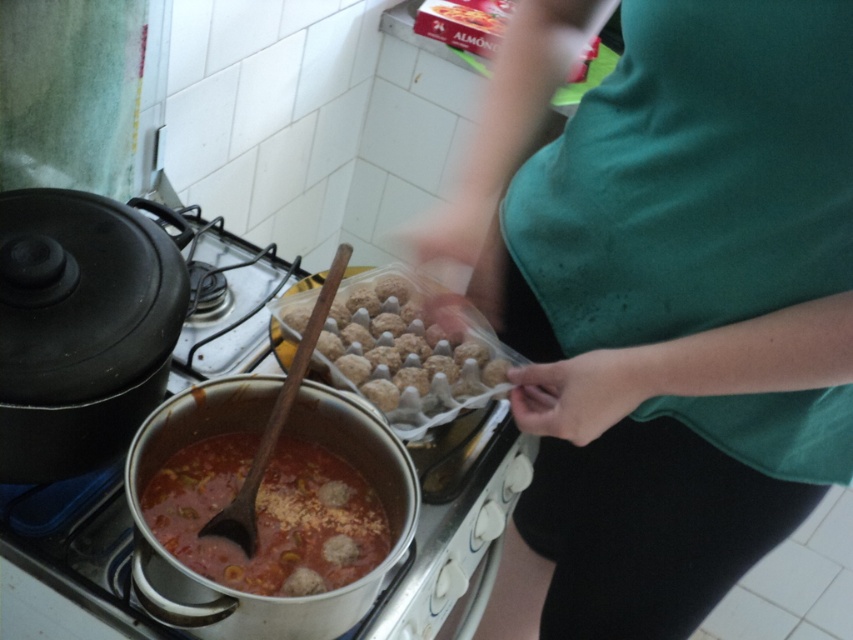
You are standing in the kitchen and want to adjust the heat on the stainless steel stove at center. However, there are brown matte meatballs at center in your way. Which object is closer to you, and can you reach the stove controls without moving the meatballs?

The stainless steel stove at center is closer to the viewer than the brown matte meatballs at center. Since the stove is closer, you can reach the controls without needing to move the meatballs.

You are a chef holding a 10 cm wide ladle and want to check the soup in the stainless steel stove at center. Can you safely reach the pot without moving closer than 70 centimeters from the stove?

The stainless steel stove at center and camera are 72.46 centimeters apart, so yes, the chef can safely reach the pot without moving closer than 70 centimeters from the stove since the distance is sufficient.